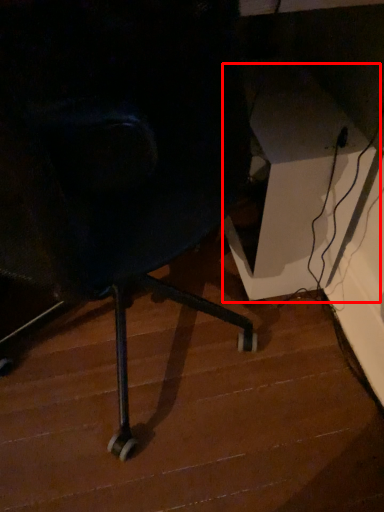
Question: From the image's perspective, considering the relative positions of table (annotated by the red box) and stair in the image provided, where is table (annotated by the red box) located with respect to the staircase?

Choices:
 (A) below
 (B) above

Answer: (B)